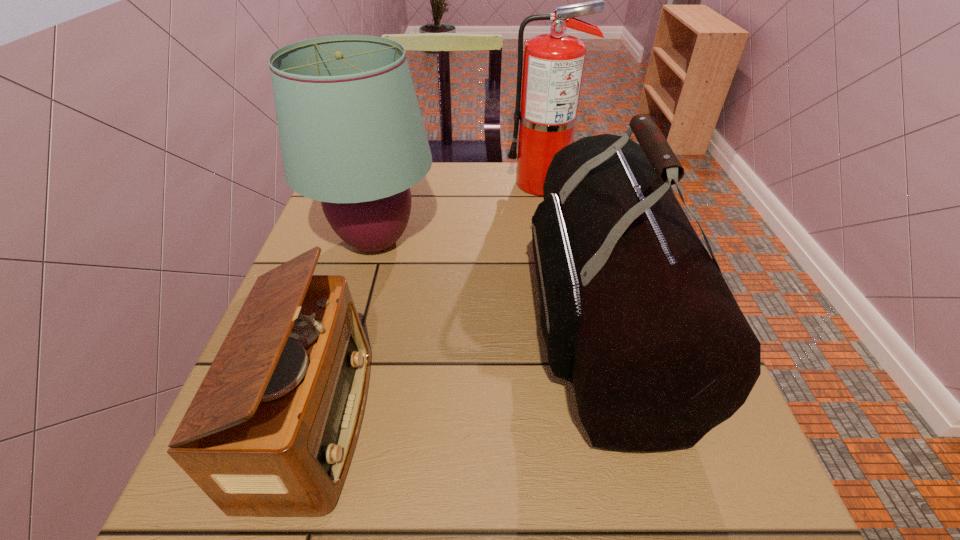
The image size is (960, 540). In order to click on the farthest object in this screenshot , I will do `click(553, 64)`.

This screenshot has height=540, width=960. Identify the location of lampshade. (352, 136).

Find the location of a particular element. duffel bag is located at coordinates (634, 312).

This screenshot has height=540, width=960. I want to click on radio receiver, so click(270, 432).

Where is `free space located 0.110m at the nozzle of the farthest object`? Image resolution: width=960 pixels, height=540 pixels. free space located 0.110m at the nozzle of the farthest object is located at coordinates (466, 183).

Locate an element on the screen. The height and width of the screenshot is (540, 960). vacant space situated at the nozzle of the farthest object is located at coordinates (447, 183).

Locate an element on the screen. This screenshot has width=960, height=540. vacant region located 0.380m at the nozzle of the farthest object is located at coordinates (366, 183).

Locate an element on the screen. Image resolution: width=960 pixels, height=540 pixels. free point located on the back of the lampshade is located at coordinates (395, 172).

Where is `free spot located on the front pocket of the duffel bag`? The image size is (960, 540). free spot located on the front pocket of the duffel bag is located at coordinates (504, 322).

At what (x,y) coordinates should I click in order to perform the action: click on blank space located 0.250m on the front pocket of the duffel bag. Please return your answer as a coordinate pair (x, y). Looking at the image, I should click on (397, 322).